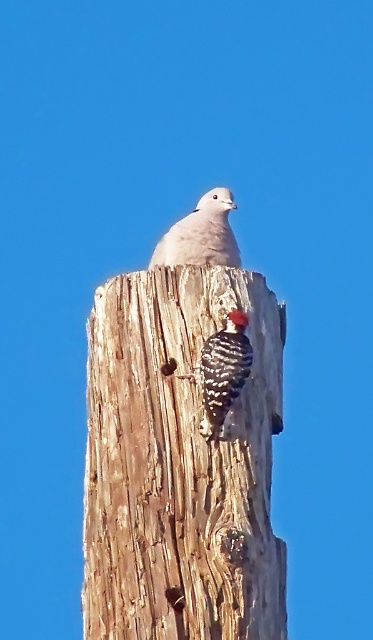
You are a birdwatcher observing the scene from a distance. You notice the wooden log at center and the white feathered bird at center. Which object is larger in size?

The white feathered bird at center is larger than the wooden log at center.

You are standing at the origin point in the image. There is a wooden log at center represented by point (x=180, y=465). Can you walk directly towards the wooden log at center without moving sideways?

Yes, since the wooden log at center is represented by point (x=180, y=465), which is a single point, you can walk directly towards it without needing to move sideways.

You are an ornithologist observing birds on a wooden post. You see a white feathered bird at center and a speckled brown woodpecker at center. Which bird appears closer to you?

The white feathered bird at center appears closer because it is further to the viewer than the speckled brown woodpecker at center.